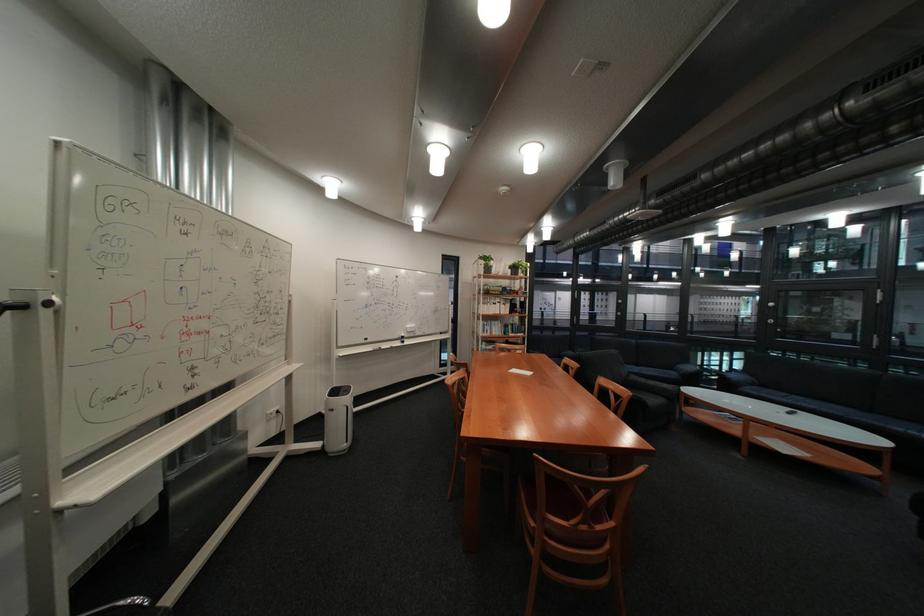
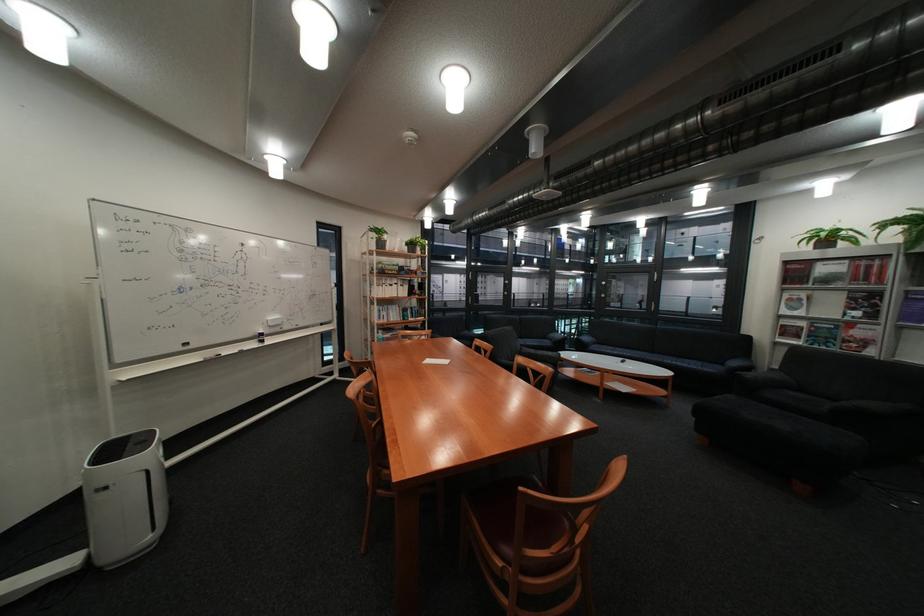
Question: In a continuous first-person perspective shot, in which direction is the camera moving?

Choices:
 (A) Left
 (B) Right
 (C) Forward
 (D) Backward

Answer: (C)